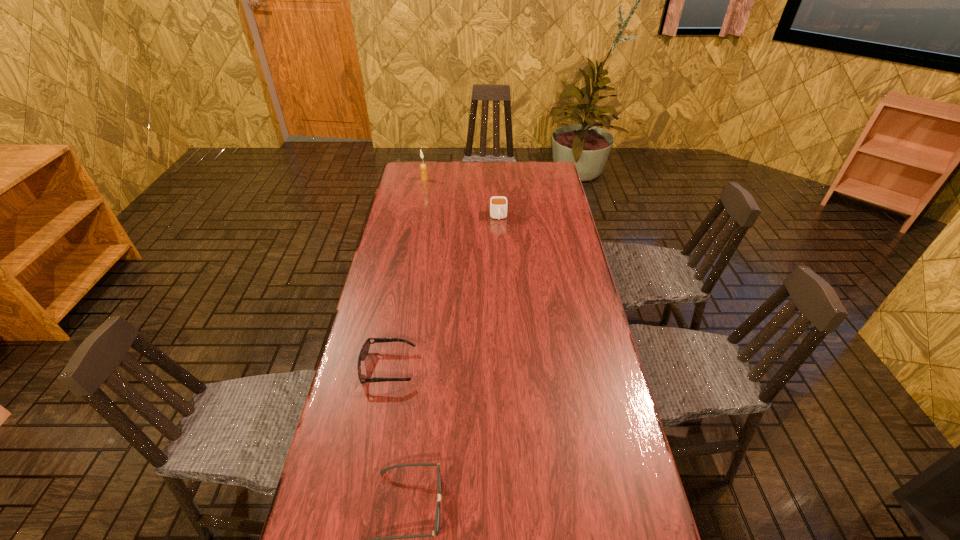
Identify the location of empty location between the sunglasses and the candle. Image resolution: width=960 pixels, height=540 pixels. (406, 273).

What are the coordinates of `vacant area between the third shortest object and the candle` in the screenshot? It's located at (462, 198).

Choose which object is the second nearest neighbor to the rightmost object. Please provide its 2D coordinates. Your answer should be formatted as a tuple, i.e. [(x, y)], where the tuple contains the x and y coordinates of a point satisfying the conditions above.

[(364, 351)]

In order to click on object that stands as the third closest to the candle in this screenshot , I will do `click(437, 517)`.

Where is `free location that satisfies the following two spatial constraints: 1. on the side with the handle of the third nearest object; 2. on the front-facing side of the second nearest object`? The width and height of the screenshot is (960, 540). free location that satisfies the following two spatial constraints: 1. on the side with the handle of the third nearest object; 2. on the front-facing side of the second nearest object is located at coordinates (507, 367).